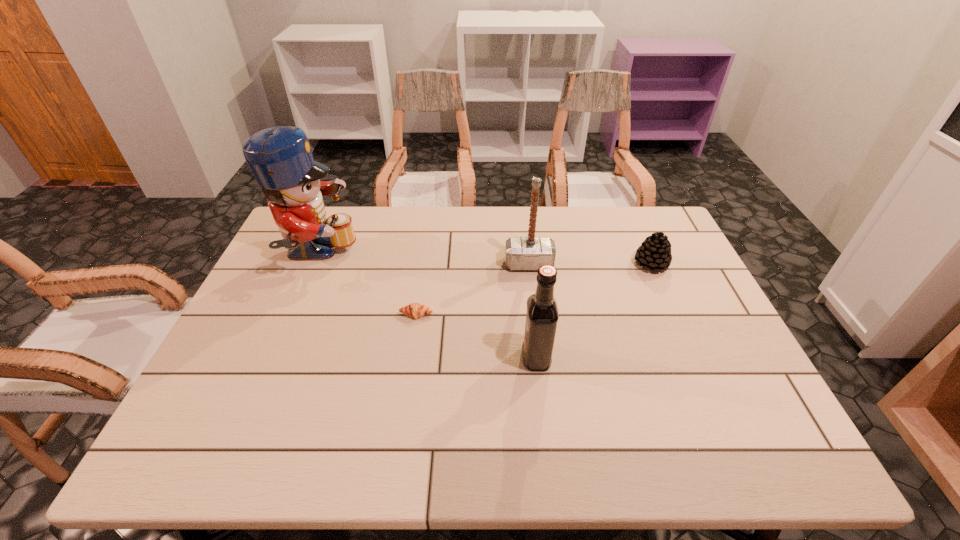
Identify the location of the leftmost object. Image resolution: width=960 pixels, height=540 pixels. (280, 158).

Locate an element on the screen. The height and width of the screenshot is (540, 960). the tallest object is located at coordinates (280, 158).

What are the coordinates of `hammer` in the screenshot? It's located at (521, 253).

Find the location of a particular element. This screenshot has width=960, height=540. the nearest object is located at coordinates (542, 315).

The width and height of the screenshot is (960, 540). In order to click on the second shortest object in this screenshot , I will do `click(654, 253)`.

I want to click on the rightmost object, so click(654, 253).

Identify the location of the shortest object. This screenshot has width=960, height=540. (414, 310).

At what (x,y) coordinates should I click in order to perform the action: click on the second nearest object. Please return your answer as a coordinate pair (x, y). Looking at the image, I should click on (414, 310).

Find the location of a particular element. The image size is (960, 540). free spot located on the front-facing side of the tallest object is located at coordinates (448, 254).

The image size is (960, 540). What are the coordinates of `free space located on the striking surface of the hammer` in the screenshot? It's located at (534, 307).